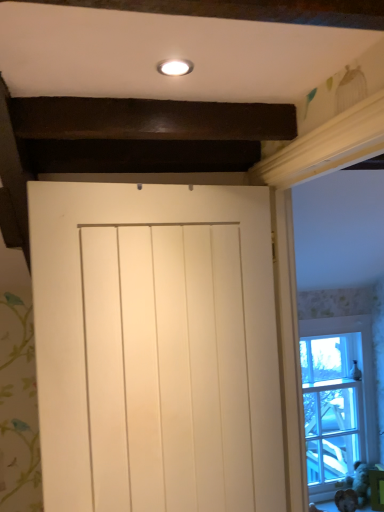
Question: Should I look upward or downward to see white matte door at center?

Choices:
 (A) down
 (B) up

Answer: (A)

Question: Does brown furry animal at lower right come in front of white painted wood at upper right?

Choices:
 (A) no
 (B) yes

Answer: (A)

Question: From the image's perspective, is brown furry animal at lower right below white painted wood at upper right?

Choices:
 (A) yes
 (B) no

Answer: (A)

Question: Is brown furry animal at lower right bigger than white painted wood at upper right?

Choices:
 (A) yes
 (B) no

Answer: (B)

Question: Is brown furry animal at lower right facing towards white painted wood at upper right?

Choices:
 (A) no
 (B) yes

Answer: (A)

Question: Does brown furry animal at lower right have a smaller size compared to white painted wood at upper right?

Choices:
 (A) yes
 (B) no

Answer: (A)

Question: Is the depth of brown furry animal at lower right greater than that of white painted wood at upper right?

Choices:
 (A) yes
 (B) no

Answer: (A)

Question: Does brown furry animal at lower right lie in front of white matte door at center?

Choices:
 (A) yes
 (B) no

Answer: (B)

Question: Is brown furry animal at lower right not near white matte door at center?

Choices:
 (A) no
 (B) yes

Answer: (B)

Question: Does brown furry animal at lower right have a larger size compared to white matte door at center?

Choices:
 (A) yes
 (B) no

Answer: (B)

Question: Does brown furry animal at lower right have a greater height compared to white matte door at center?

Choices:
 (A) yes
 (B) no

Answer: (B)

Question: From the image's perspective, is brown furry animal at lower right over white matte door at center?

Choices:
 (A) yes
 (B) no

Answer: (B)

Question: Is brown furry animal at lower right looking in the opposite direction of white matte door at center?

Choices:
 (A) no
 (B) yes

Answer: (A)

Question: Is white painted wood at upper right taller than clear glass window at right?

Choices:
 (A) yes
 (B) no

Answer: (A)